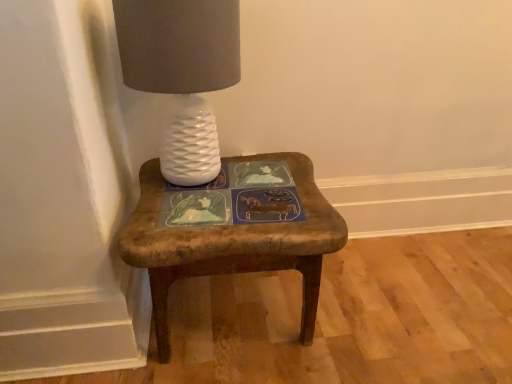
What is the approximate height of white textured lamp at upper left?

The height of white textured lamp at upper left is 15.89 inches.

Describe the element at coordinates (181, 74) in the screenshot. I see `white textured lamp at upper left` at that location.

The image size is (512, 384). I want to click on white textured lamp at upper left, so click(x=181, y=74).

What do you see at coordinates (223, 232) in the screenshot? I see `wooden stool at center` at bounding box center [223, 232].

The image size is (512, 384). I want to click on wooden stool at center, so click(x=223, y=232).

Measure the distance between wooden stool at center and camera.

wooden stool at center and camera are 30.67 inches apart from each other.

Identify the location of white textured lamp at upper left. The image size is (512, 384). (181, 74).

Is white textured lamp at upper left at the right side of wooden stool at center?

No.

Based on the photo, does white textured lamp at upper left come behind wooden stool at center?

No, white textured lamp at upper left is in front of wooden stool at center.

Does point (165, 67) come closer to viewer compared to point (300, 154)?

Yes, point (165, 67) is in front of point (300, 154).

From the image's perspective, is white textured lamp at upper left on wooden stool at center?

Yes, from the image's perspective, white textured lamp at upper left is above wooden stool at center.

From a real-world perspective, between white textured lamp at upper left and wooden stool at center, who is vertically higher?

From a 3D spatial view, white textured lamp at upper left is above.

Can you confirm if white textured lamp at upper left is thinner than wooden stool at center?

Indeed, white textured lamp at upper left has a lesser width compared to wooden stool at center.

Is white textured lamp at upper left taller or shorter than wooden stool at center?

Clearly, white textured lamp at upper left is taller compared to wooden stool at center.

Considering the sizes of objects white textured lamp at upper left and wooden stool at center in the image provided, who is smaller, white textured lamp at upper left or wooden stool at center?

Smaller between the two is white textured lamp at upper left.

Is white textured lamp at upper left located outside wooden stool at center?

Yes, white textured lamp at upper left is located beyond the bounds of wooden stool at center.

Is the surface of white textured lamp at upper left in direct contact with wooden stool at center?

white textured lamp at upper left is not next to wooden stool at center, and they're not touching.

Is white textured lamp at upper left looking in the opposite direction of wooden stool at center?

white textured lamp at upper left is not turned away from wooden stool at center.

Measure the distance between white textured lamp at upper left and wooden stool at center.

9.64 inches.

Image resolution: width=512 pixels, height=384 pixels. I want to click on table lamp lying above the wooden stool at center (from the image's perspective), so click(181, 74).

Is wooden stool at center at the left side of white textured lamp at upper left?

No, wooden stool at center is not to the left of white textured lamp at upper left.

Relative to white textured lamp at upper left, is wooden stool at center in front or behind?

wooden stool at center is behind white textured lamp at upper left.

Which is less distant, (177, 238) or (176, 168)?

Point (177, 238) is closer to the camera than point (176, 168).

From the image's perspective, who appears lower, wooden stool at center or white textured lamp at upper left?

wooden stool at center is shown below in the image.

From a real-world perspective, is wooden stool at center positioned above or below white textured lamp at upper left?

In terms of real-world spatial position, wooden stool at center is below white textured lamp at upper left.

Looking at their sizes, would you say wooden stool at center is wider or thinner than white textured lamp at upper left?

Clearly, wooden stool at center has more width compared to white textured lamp at upper left.

Considering the sizes of objects wooden stool at center and white textured lamp at upper left in the image provided, who is taller, wooden stool at center or white textured lamp at upper left?

white textured lamp at upper left.

Which of these two, wooden stool at center or white textured lamp at upper left, is bigger?

wooden stool at center is bigger.

From the picture: Choose the correct answer: Is wooden stool at center inside white textured lamp at upper left or outside it?

wooden stool at center cannot be found inside white textured lamp at upper left.

From the picture: Is wooden stool at center directly adjacent to white textured lamp at upper left?

No, wooden stool at center is not in contact with white textured lamp at upper left.

Is wooden stool at center aimed at white textured lamp at upper left?

No, wooden stool at center is not turned towards white textured lamp at upper left.

Can you tell me how much wooden stool at center and white textured lamp at upper left differ in facing direction?

They differ by 0.000372 degrees in their facing directions.

In the image, there is a wooden stool at center. Where is `table lamp above it (from the image's perspective)`? This screenshot has height=384, width=512. table lamp above it (from the image's perspective) is located at coordinates (181, 74).

This screenshot has width=512, height=384. Identify the location of table lamp on the left of wooden stool at center. [181, 74].

Where is `stool below the white textured lamp at upper left (from a real-world perspective)`? stool below the white textured lamp at upper left (from a real-world perspective) is located at coordinates (223, 232).